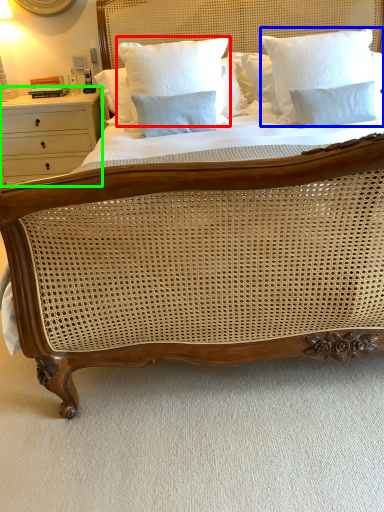
Question: Considering the real-world distances, which object is closest to pillow (highlighted by a red box)? pillow (highlighted by a blue box) or nightstand (highlighted by a green box).

Choices:
 (A) pillow
 (B) nightstand

Answer: (A)